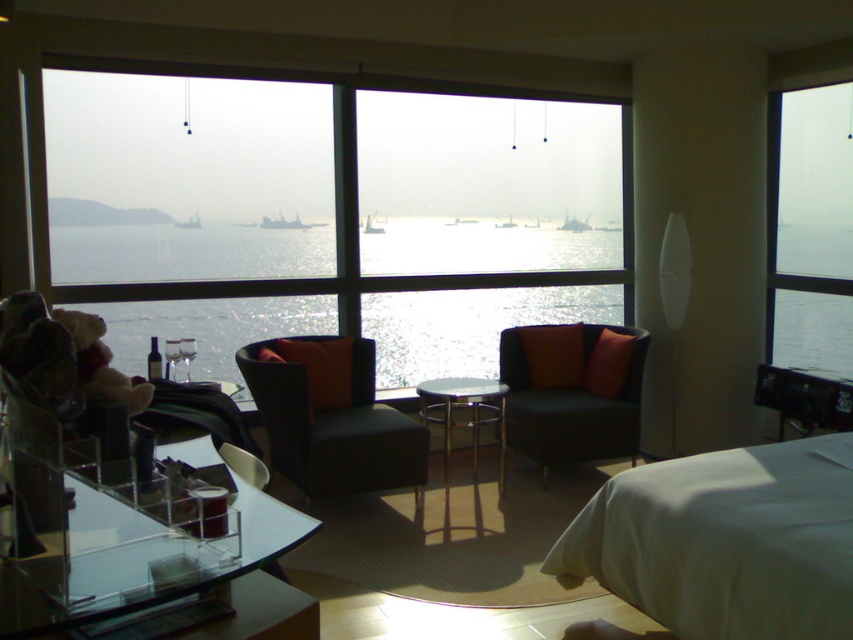
Question: Considering the real-world distances, which object is closest to the glistening water at center?

Choices:
 (A) metallic silver table at center
 (B) white fabric bed at lower right

Answer: (A)

Question: Is glistening water at center above black fabric chair at center?

Choices:
 (A) no
 (B) yes

Answer: (B)

Question: Does transparent acrylic glass table at lower left lie behind transparent glass window at right?

Choices:
 (A) no
 (B) yes

Answer: (A)

Question: Which of the following is the closest to the observer?

Choices:
 (A) transparent acrylic glass table at lower left
 (B) transparent glass window at center
 (C) matte black couch at center

Answer: (A)

Question: Does transparent acrylic glass table at lower left appear on the left side of glistening water at center?

Choices:
 (A) yes
 (B) no

Answer: (A)

Question: Among these points, which one is farthest from the camera?

Choices:
 (A) (335, 445)
 (B) (454, 380)
 (C) (231, 336)

Answer: (C)